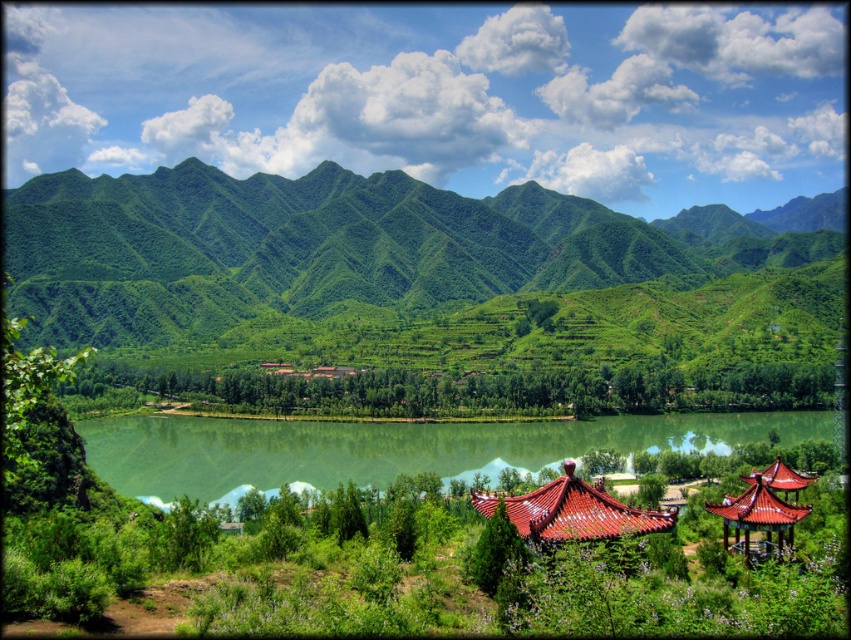
Question: Which point is closer to the camera?

Choices:
 (A) shiny red tile gazebo at center
 (B) green smooth water at center
 (C) shiny red roof gazebo at lower right
 (D) green textured mountain at center

Answer: (A)

Question: Which object is the farthest from the shiny red roof gazebo at lower right?

Choices:
 (A) shiny red tile gazebo at center
 (B) green textured mountain at center

Answer: (B)

Question: Is green textured mountain at center to the left of green smooth water at center from the viewer's perspective?

Choices:
 (A) no
 (B) yes

Answer: (A)

Question: Does shiny red tile gazebo at center have a greater width compared to shiny red roof gazebo at lower right?

Choices:
 (A) yes
 (B) no

Answer: (B)

Question: Based on their relative distances, which object is nearer to the green textured mountain at center?

Choices:
 (A) shiny red roof gazebo at lower right
 (B) green smooth water at center

Answer: (B)

Question: From the image, what is the correct spatial relationship of green smooth water at center in relation to shiny red tile gazebo at center?

Choices:
 (A) left
 (B) right

Answer: (A)